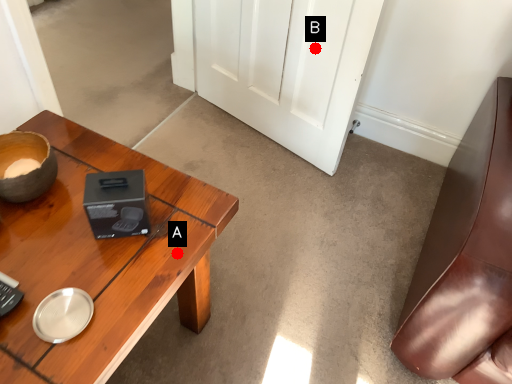
Question: Two points are circled on the image, labeled by A and B beside each circle. Which point appears closest to the camera in this image?

Choices:
 (A) A is closer
 (B) B is closer

Answer: (A)